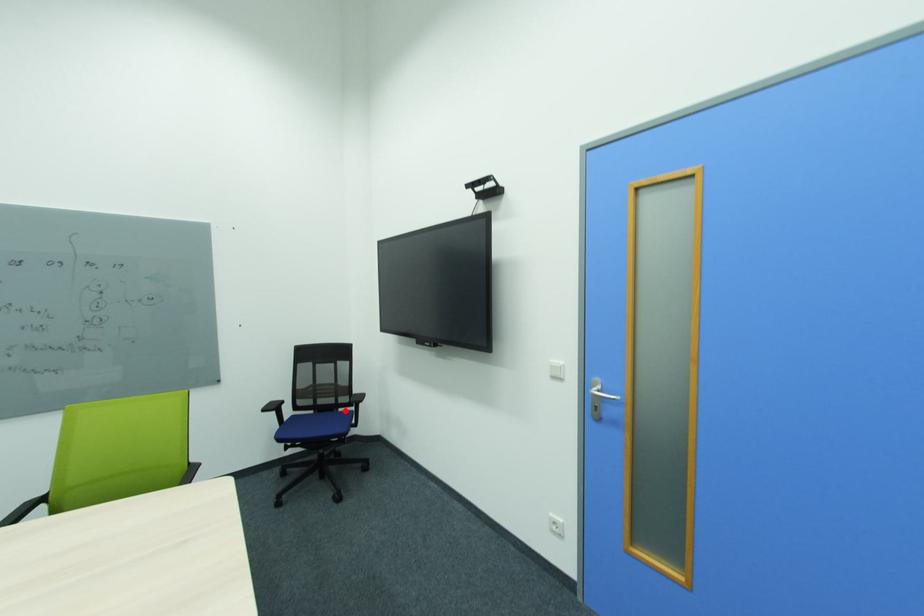
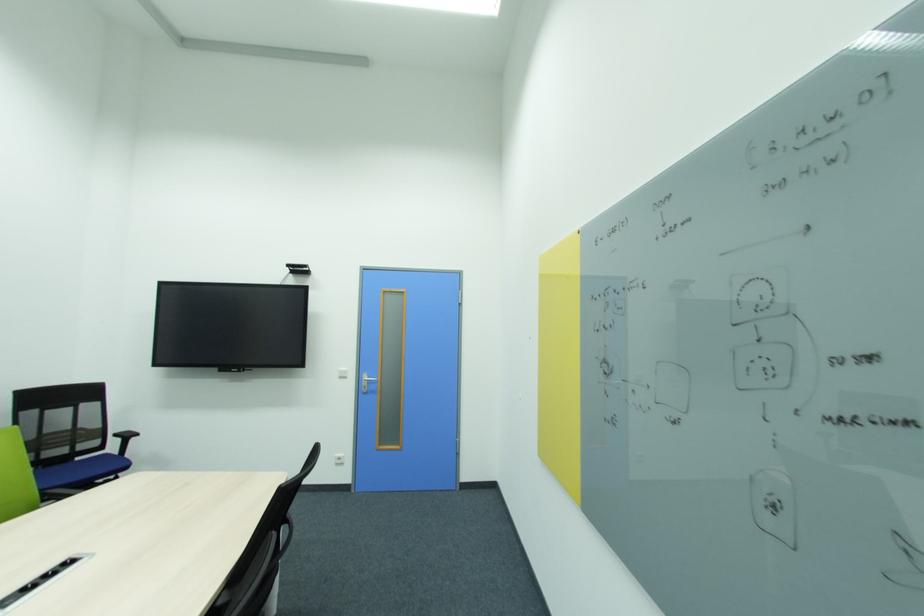
The point at the highlighted location is marked in the first image. Where is the corresponding point in the second image?

(82, 460)